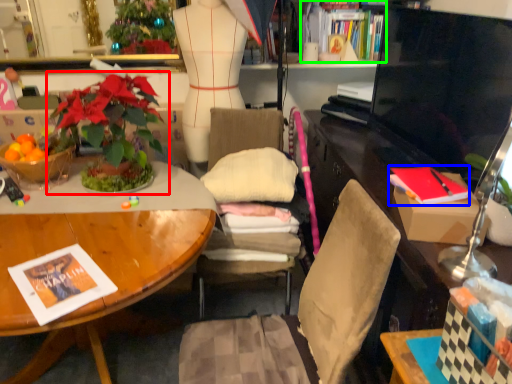
Question: Which is farther away from houseplant (highlighted by a red box)? magazine (highlighted by a blue box) or book (highlighted by a green box)?

Choices:
 (A) magazine
 (B) book

Answer: (B)